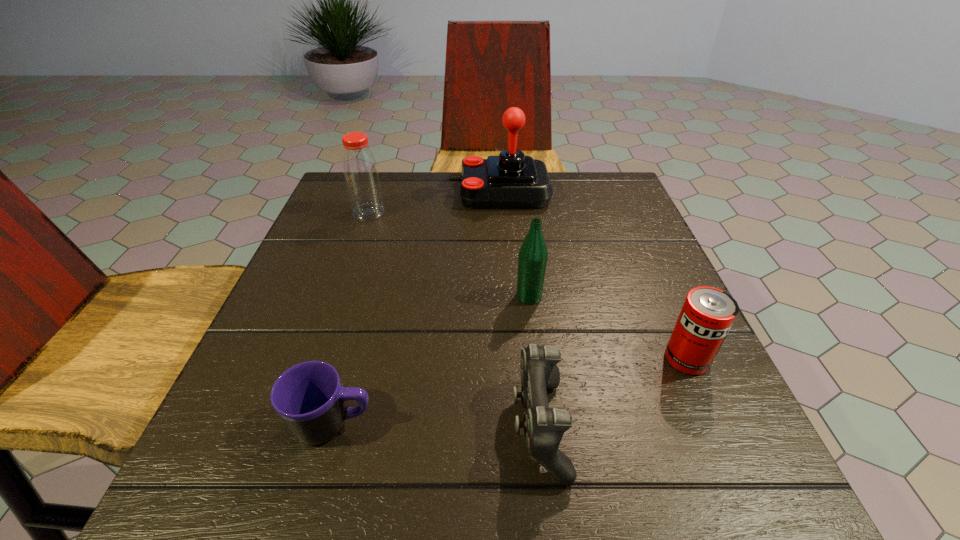
Identify the location of control situated at the near edge. (544, 427).

Locate an element on the screen. The height and width of the screenshot is (540, 960). mug present at the near edge is located at coordinates (309, 398).

The image size is (960, 540). I want to click on bottle that is at the left edge, so click(x=362, y=180).

This screenshot has width=960, height=540. Identify the location of mug located in the left edge section of the desktop. (309, 398).

Find the location of a particular element. object that is at the right edge is located at coordinates (707, 315).

Where is `object that is positioned at the far left corner`? object that is positioned at the far left corner is located at coordinates (362, 180).

The height and width of the screenshot is (540, 960). I want to click on object located in the near left corner section of the desktop, so click(x=309, y=398).

Where is `blank area at the far edge`? blank area at the far edge is located at coordinates (400, 213).

Where is `free space at the near edge`? free space at the near edge is located at coordinates (459, 487).

Where is `free space at the left edge`? The height and width of the screenshot is (540, 960). free space at the left edge is located at coordinates (312, 228).